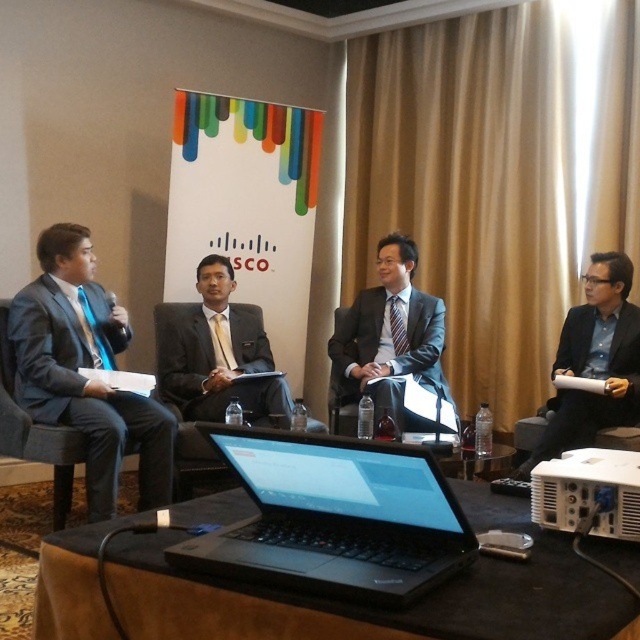
Question: Which of the following is the farthest from the observer?

Choices:
 (A) (428, 420)
 (B) (372, 620)
 (C) (99, 397)

Answer: (A)

Question: Does black matte table at center come behind blue fabric suit at right?

Choices:
 (A) no
 (B) yes

Answer: (A)

Question: Which point is closer to the camera?

Choices:
 (A) black matte table at center
 (B) matte black suit at center

Answer: (A)

Question: Which point is closer to the camera taking this photo?

Choices:
 (A) (547, 584)
 (B) (420, 497)

Answer: (A)

Question: Can you confirm if matte black suit at left is thinner than matte black suit at center?

Choices:
 (A) yes
 (B) no

Answer: (A)

Question: Can you confirm if black matte table at center is thinner than matte black suit at center?

Choices:
 (A) no
 (B) yes

Answer: (A)